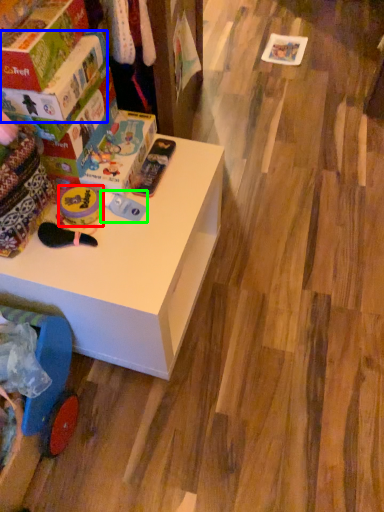
Question: Which is farther away from toy (highlighted by a red box)? box (highlighted by a blue box) or toy (highlighted by a green box)?

Choices:
 (A) box
 (B) toy

Answer: (A)